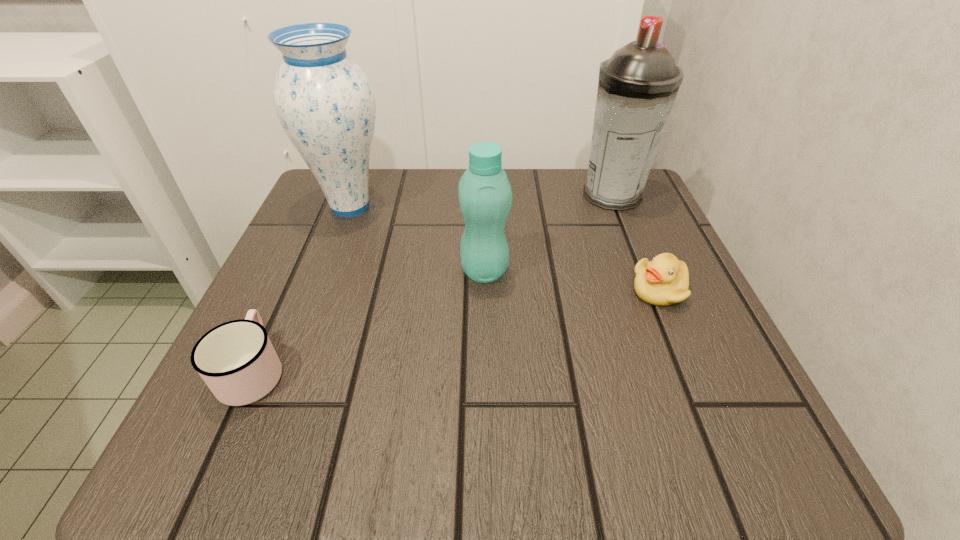
Locate an element on the screen. The image size is (960, 540). free space between the third object from right to left and the vase is located at coordinates (418, 239).

Locate which object is the second closest to the bottle. Please provide its 2D coordinates. Your answer should be formatted as a tuple, i.e. [(x, y)], where the tuple contains the x and y coordinates of a point satisfying the conditions above.

[(663, 281)]

Locate which object is the fourth closest to the mug. Please provide its 2D coordinates. Your answer should be formatted as a tuple, i.e. [(x, y)], where the tuple contains the x and y coordinates of a point satisfying the conditions above.

[(638, 84)]

Locate an element on the screen. The height and width of the screenshot is (540, 960). free location that satisfies the following two spatial constraints: 1. on the side of the nearest object with the handle; 2. on the left side of the aerosol can is located at coordinates (332, 195).

At what (x,y) coordinates should I click in order to perform the action: click on vacant space that satisfies the following two spatial constraints: 1. on the side of the mug with the handle; 2. on the left side of the bottle. Please return your answer as a coordinate pair (x, y). The image size is (960, 540). Looking at the image, I should click on (298, 271).

Find the location of a particular element. free spot that satisfies the following two spatial constraints: 1. on the side of the mug with the handle; 2. on the left side of the bottle is located at coordinates (298, 271).

Where is `vacant point that satisfies the following two spatial constraints: 1. on the side of the nearest object with the handle; 2. on the right side of the aerosol can`? The height and width of the screenshot is (540, 960). vacant point that satisfies the following two spatial constraints: 1. on the side of the nearest object with the handle; 2. on the right side of the aerosol can is located at coordinates (332, 195).